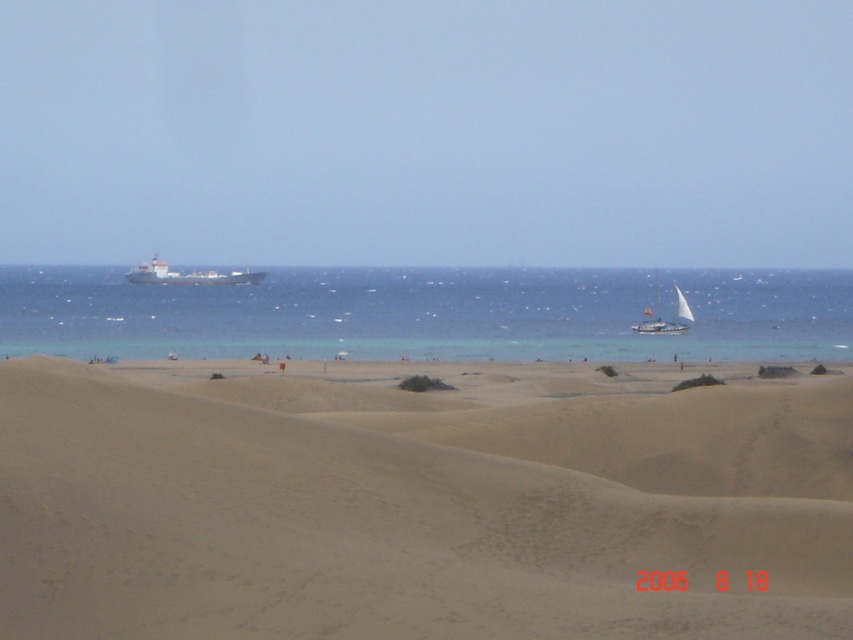
You are standing on the beach in the image and want to reach the point marked at coordinates [486,449]. If your walking speed is 3 feet per second, how many seconds will it take you to reach that point?

The point at coordinates [486,449] is 62.72 feet away from the viewer. At a walking speed of 3 feet per second, it would take approximately 20.9 seconds to reach it.